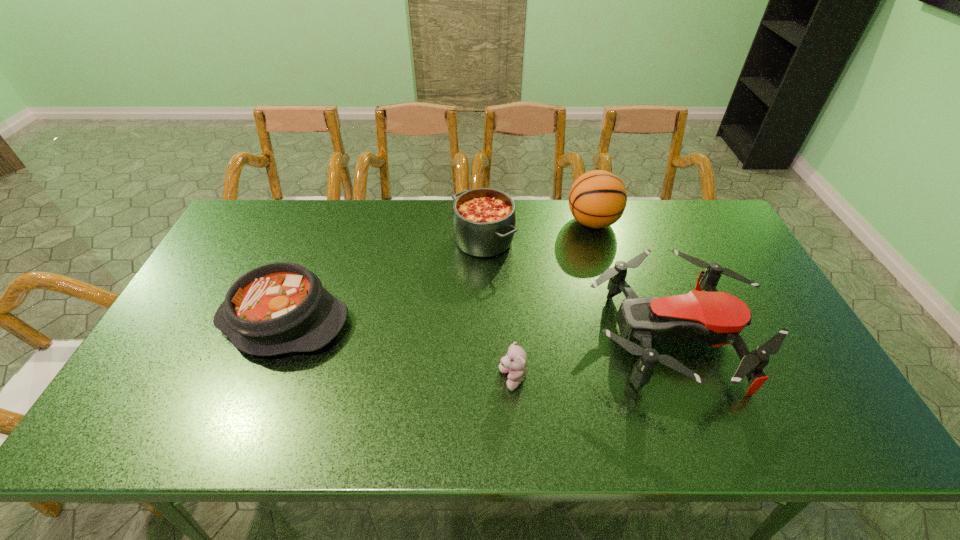
Identify the location of basketball. (597, 199).

Find the location of a particular element. the farther casserole is located at coordinates (484, 220).

Locate an element on the screen. drone is located at coordinates (717, 318).

The height and width of the screenshot is (540, 960). What are the coordinates of `the left casserole` in the screenshot? It's located at (277, 308).

Where is `the nearer casserole`? the nearer casserole is located at coordinates (277, 308).

Image resolution: width=960 pixels, height=540 pixels. I want to click on teddy bear, so click(515, 362).

Locate an element on the screen. The height and width of the screenshot is (540, 960). vacant position located 0.250m on the right of the basketball is located at coordinates (692, 222).

This screenshot has height=540, width=960. I want to click on free space located 0.120m on the right of the farther casserole, so click(552, 240).

Find the location of a particular element. The height and width of the screenshot is (540, 960). vacant space located on the camera side of the drone is located at coordinates (549, 338).

Identify the location of vacant area situated on the camera side of the drone. Image resolution: width=960 pixels, height=540 pixels. (496, 338).